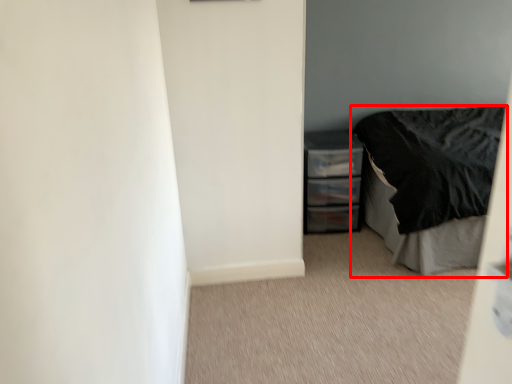
Question: Observing the image, what is the correct spatial positioning of bed (annotated by the red box) in reference to chest of drawers?

Choices:
 (A) left
 (B) right

Answer: (B)